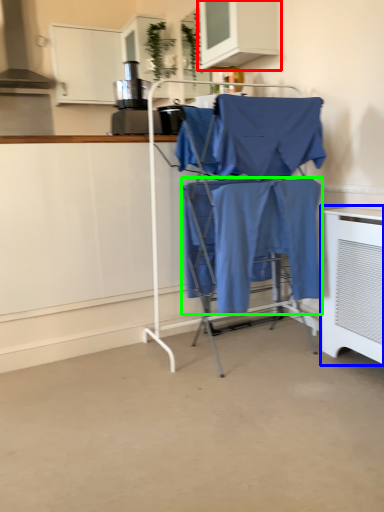
Question: Which object is positioned closest to cabinetry (highlighted by a red box)? Select from home appliance (highlighted by a blue box) and fabric (highlighted by a green box).

Choices:
 (A) home appliance
 (B) fabric

Answer: (B)